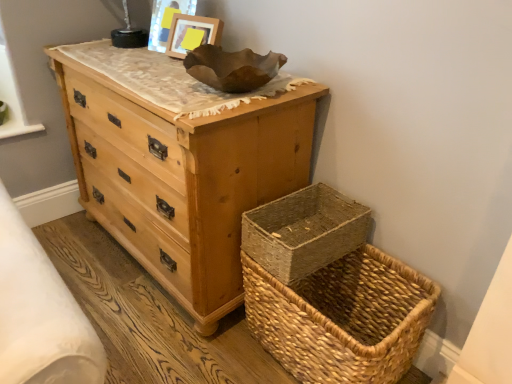
In order to click on vacant region to the left of natural woven picnic basket at lower right in this screenshot , I will do `click(208, 348)`.